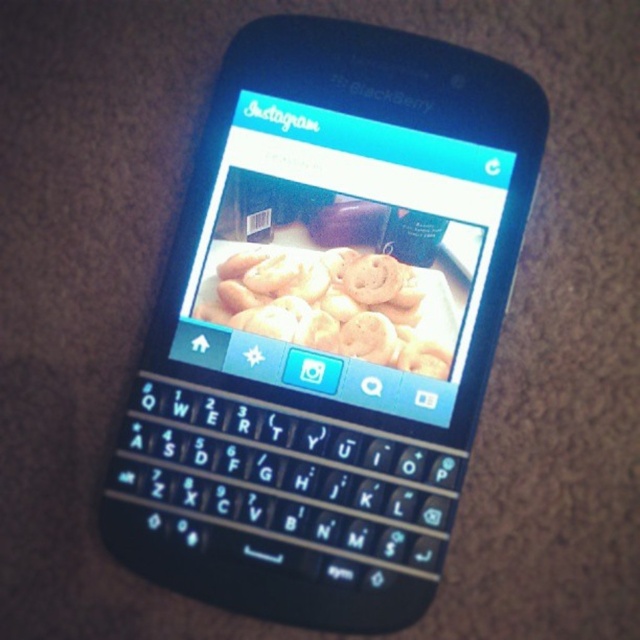
Question: Is black plastic smartphone at center thinner than golden matte cookies at center?

Choices:
 (A) no
 (B) yes

Answer: (A)

Question: Is matte plastic screen at center positioned at the back of golden matte cookies at center?

Choices:
 (A) yes
 (B) no

Answer: (B)

Question: Estimate the real-world distances between objects in this image. Which object is closer to the black plastic smartphone at center?

Choices:
 (A) matte plastic screen at center
 (B) golden matte cookies at center

Answer: (A)

Question: Which object appears farthest from the camera in this image?

Choices:
 (A) black plastic smartphone at center
 (B) matte plastic screen at center

Answer: (B)

Question: Is black plastic smartphone at center thinner than golden matte cookies at center?

Choices:
 (A) yes
 (B) no

Answer: (B)

Question: Which is nearer to the golden matte cookies at center?

Choices:
 (A) matte plastic screen at center
 (B) black plastic smartphone at center

Answer: (A)